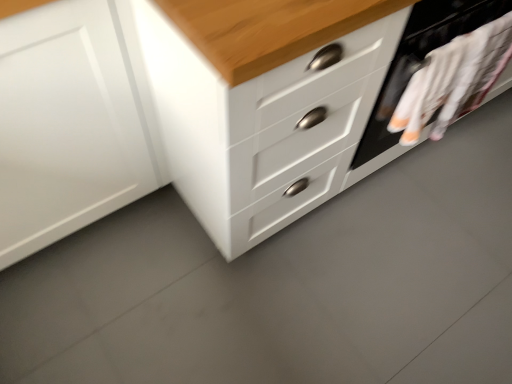
Locate an element on the screen. The width and height of the screenshot is (512, 384). white matte cabinet at left is located at coordinates (71, 123).

In order to face white fabric at right, should I rotate leftwards or rightwards?

You should rotate right by 26.175 degrees.

Image resolution: width=512 pixels, height=384 pixels. In order to click on white glossy chest of drawers at center in this screenshot , I will do `click(244, 130)`.

Visually, is white glossy chest of drawers at center positioned to the left or to the right of white matte cabinet at left?

white glossy chest of drawers at center is to the right of white matte cabinet at left.

You are a GUI agent. You are given a task and a screenshot of the screen. Output one action in this format:
    pyautogui.click(x=<x>, y=<y>)
    Task: Click on the cabinetry in front of the white glossy chest of drawers at center
    The height and width of the screenshot is (384, 512).
    Given the screenshot: What is the action you would take?
    pyautogui.click(x=71, y=123)

Is white glossy chest of drawers at center positioned with its back to white matte cabinet at left?

white glossy chest of drawers at center is not turned away from white matte cabinet at left.

Looking at this image, can you tell me how much white glossy chest of drawers at center and white matte cabinet at left differ in facing direction?

They differ by 0.257 degrees in their facing directions.

Considering the positions of objects white fabric at right and white glossy chest of drawers at center in the image provided, who is more to the left, white fabric at right or white glossy chest of drawers at center?

Positioned to the left is white glossy chest of drawers at center.

Is white fabric at right not near white glossy chest of drawers at center?

That's not correct — white fabric at right is a little close to white glossy chest of drawers at center.

Based on the photo, does white fabric at right have a larger size compared to white glossy chest of drawers at center?

No.

From the image's perspective, is white fabric at right above or below white glossy chest of drawers at center?

white fabric at right is below white glossy chest of drawers at center.

Based on the photo, between white matte cabinet at left and white glossy chest of drawers at center, which one has less height?

white matte cabinet at left.

How many degrees apart are the facing directions of white matte cabinet at left and white glossy chest of drawers at center?

0.257 degrees.

From the image's perspective, is white matte cabinet at left above or below white glossy chest of drawers at center?

white matte cabinet at left is situated lower than white glossy chest of drawers at center in the image.

From a real-world perspective, is white matte cabinet at left physically located above or below white glossy chest of drawers at center?

In terms of real-world spatial position, white matte cabinet at left is below white glossy chest of drawers at center.

Where is `laundry above the white glossy chest of drawers at center (from a real-world perspective)`? Image resolution: width=512 pixels, height=384 pixels. laundry above the white glossy chest of drawers at center (from a real-world perspective) is located at coordinates (453, 80).

Is white glossy chest of drawers at center beside white fabric at right?

They are not placed beside each other.

Is white fabric at right oriented towards white matte cabinet at left?

No.

How far apart are white fabric at right and white matte cabinet at left?

white fabric at right is 34.06 inches from white matte cabinet at left.

Is white fabric at right closer to the viewer compared to white matte cabinet at left?

No, the depth of white fabric at right is greater than that of white matte cabinet at left.

Where is `laundry above the white matte cabinet at left (from the image's perspective)`? This screenshot has width=512, height=384. laundry above the white matte cabinet at left (from the image's perspective) is located at coordinates (453, 80).

Considering the relative sizes of white matte cabinet at left and white fabric at right in the image provided, is white matte cabinet at left bigger than white fabric at right?

Correct, white matte cabinet at left is larger in size than white fabric at right.

Is white matte cabinet at left facing away from white fabric at right?

white matte cabinet at left is not turned away from white fabric at right.

Where is `cabinetry lying on the left of white glossy chest of drawers at center`? cabinetry lying on the left of white glossy chest of drawers at center is located at coordinates (71, 123).

Locate an element on the screen. The height and width of the screenshot is (384, 512). chest of drawers above the white fabric at right (from the image's perspective) is located at coordinates (244, 130).

Looking at the image, which one is located further to white fabric at right, white matte cabinet at left or white glossy chest of drawers at center?

white matte cabinet at left is positioned further to the anchor white fabric at right.

When comparing their distances from white matte cabinet at left, does white fabric at right or white glossy chest of drawers at center seem closer?

Based on the image, white glossy chest of drawers at center appears to be nearer to white matte cabinet at left.

Estimate the real-world distances between objects in this image. Which object is closer to white glossy chest of drawers at center, white matte cabinet at left or white fabric at right?

Among the two, white matte cabinet at left is located nearer to white glossy chest of drawers at center.

From the image, which object appears to be farther from white fabric at right, white glossy chest of drawers at center or white matte cabinet at left?

Among the two, white matte cabinet at left is located further to white fabric at right.

Estimate the real-world distances between objects in this image. Which object is closer to white glossy chest of drawers at center, white fabric at right or white matte cabinet at left?

The object closer to white glossy chest of drawers at center is white matte cabinet at left.

In the scene shown: From the image, which object appears to be nearer to white matte cabinet at left, white glossy chest of drawers at center or white fabric at right?

white glossy chest of drawers at center is positioned closer to the anchor white matte cabinet at left.

Identify the location of the chest of drawers located between white matte cabinet at left and white fabric at right in the left-right direction. Image resolution: width=512 pixels, height=384 pixels. (244, 130).